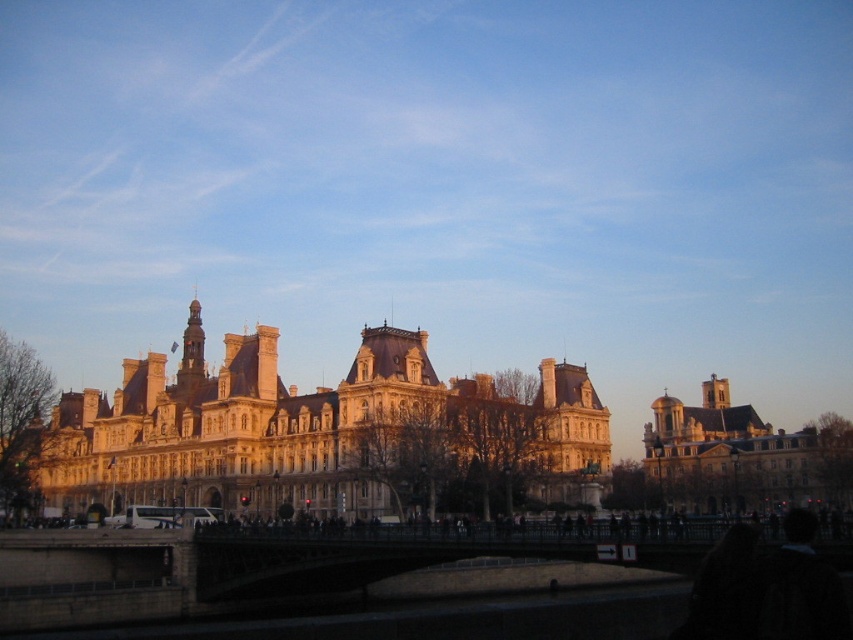
Question: Can you confirm if golden stone palace at center is positioned below golden stone church at right?

Choices:
 (A) no
 (B) yes

Answer: (A)

Question: Which of the following is the farthest from the observer?

Choices:
 (A) golden stone palace at center
 (B) golden stone church at right

Answer: (B)

Question: Which of the following is the farthest from the observer?

Choices:
 (A) golden stone palace at center
 (B) golden stone church at right

Answer: (B)

Question: Does golden stone palace at center have a smaller size compared to golden stone church at right?

Choices:
 (A) yes
 (B) no

Answer: (B)

Question: Does golden stone palace at center lie behind golden stone church at right?

Choices:
 (A) yes
 (B) no

Answer: (B)

Question: Among these objects, which one is nearest to the camera?

Choices:
 (A) golden stone church at right
 (B) golden stone palace at center

Answer: (B)